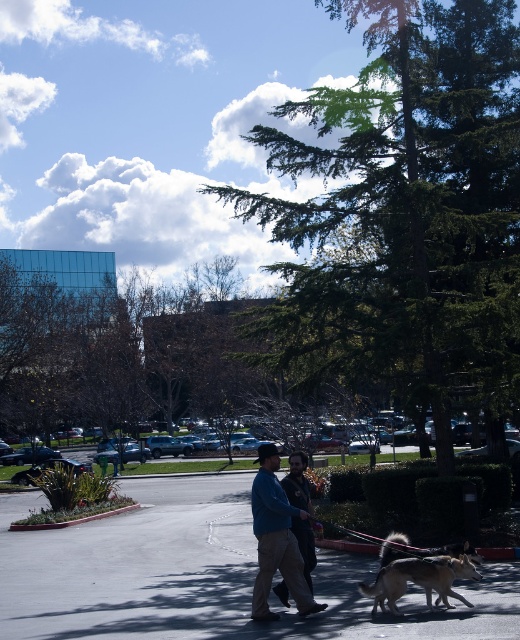
Question: Can you confirm if gray asphalt pavement at center is bigger than brown fur dog at lower right?

Choices:
 (A) yes
 (B) no

Answer: (A)

Question: Which of these objects is positioned farthest from the brown fur dog at lower right?

Choices:
 (A) green leafy tree at center
 (B) gray asphalt pavement at center
 (C) blue denim jacket at center

Answer: (A)

Question: Which is nearer to the blue denim jacket at center?

Choices:
 (A) brown fur dog at lower right
 (B) gray asphalt pavement at center

Answer: (A)

Question: Is green leafy tree at center behind gray asphalt pavement at center?

Choices:
 (A) no
 (B) yes

Answer: (B)

Question: Which object is positioned closest to the blue denim jacket at center?

Choices:
 (A) gray asphalt pavement at center
 (B) green leafy tree at center

Answer: (A)

Question: Does green leafy tree at center appear over brown fur dog at lower right?

Choices:
 (A) no
 (B) yes

Answer: (B)